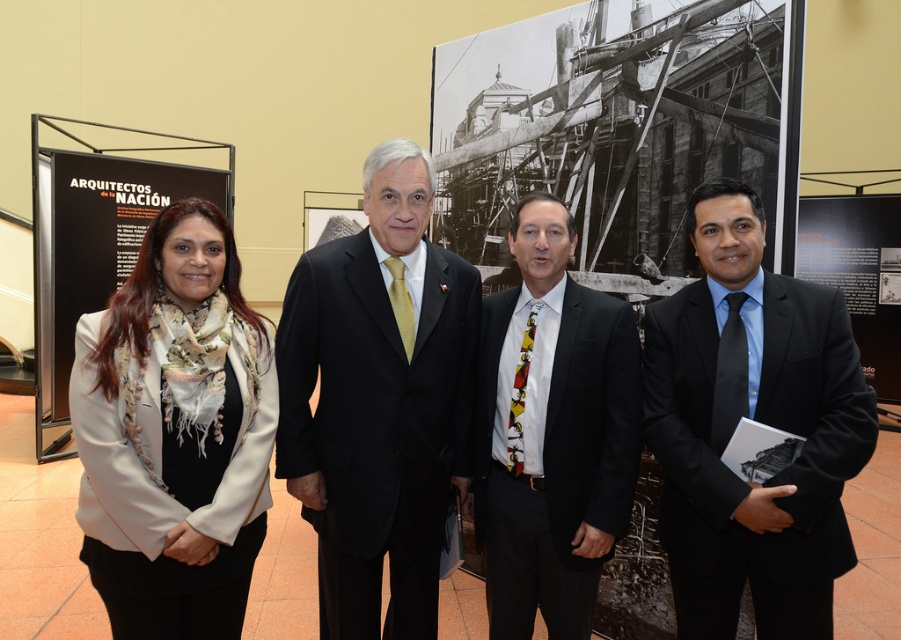
This screenshot has width=901, height=640. What do you see at coordinates (378, 401) in the screenshot? I see `black satin suit at center` at bounding box center [378, 401].

Between black satin suit at center and black silk suit at center, which one has more height?

black satin suit at center

Which is behind, point (471, 376) or point (483, 532)?

Point (483, 532)

Locate an element on the screen. black satin suit at center is located at coordinates (378, 401).

Between black silk suit at center and white fabric at upper left, which one appears on the left side from the viewer's perspective?

From the viewer's perspective, white fabric at upper left appears more on the left side.

Is point (497, 477) more distant than point (70, 365)?

No.

The width and height of the screenshot is (901, 640). What do you see at coordinates (551, 433) in the screenshot?
I see `black silk suit at center` at bounding box center [551, 433].

Find the location of a particular element. The height and width of the screenshot is (640, 901). black silk suit at center is located at coordinates (551, 433).

Between black suit at right and black satin suit at center, which one appears on the left side from the viewer's perspective?

black satin suit at center

Does point (836, 349) lie in front of point (417, 198)?

That is True.

Find the location of a particular element. black suit at right is located at coordinates (754, 419).